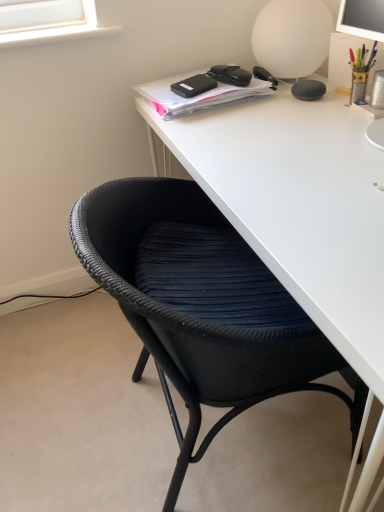
Identify the location of matte black speaker at upper right, placed as the 3th stationery when sorted from left to right. The image size is (384, 512). (308, 90).

Describe the element at coordinates (201, 306) in the screenshot. The image size is (384, 512). I see `black woven chair at lower left` at that location.

Find the location of `black matte hard drive at upper center, the 4th stationery in the right-to-left sequence`. black matte hard drive at upper center, the 4th stationery in the right-to-left sequence is located at coordinates (193, 86).

The height and width of the screenshot is (512, 384). Find the location of `white matte desk at center`. white matte desk at center is located at coordinates (298, 205).

Is the surface of metallic gold pen holder at upper right, acting as the 4th stationery starting from the left, in direct contact with black matte glasses at upper center, acting as the third stationery starting from the right?

There is a gap between metallic gold pen holder at upper right, acting as the 4th stationery starting from the left, and black matte glasses at upper center, acting as the third stationery starting from the right.

Is metallic gold pen holder at upper right, acting as the 4th stationery starting from the left, surrounding black matte glasses at upper center, arranged as the second stationery when viewed from the left?

No.

The height and width of the screenshot is (512, 384). What are the coordinates of `the 2nd stationery above the metallic gold pen holder at upper right, acting as the 4th stationery starting from the left (from the image's perspective)` in the screenshot? It's located at (230, 75).

Is black woven chair at lower left shorter than white matte table lamp at upper right?

Incorrect, the height of black woven chair at lower left does not fall short of that of white matte table lamp at upper right.

Considering the relative sizes of black woven chair at lower left and white matte table lamp at upper right in the image provided, is black woven chair at lower left thinner than white matte table lamp at upper right?

Incorrect, the width of black woven chair at lower left is not less than that of white matte table lamp at upper right.

Can white matte table lamp at upper right be found inside black woven chair at lower left?

No.

Considering the relative sizes of black matte hard drive at upper center, placed as the first stationery when sorted from left to right, and matte black speaker at upper right, which is the second stationery from right to left, in the image provided, is black matte hard drive at upper center, placed as the first stationery when sorted from left to right, taller than matte black speaker at upper right, which is the second stationery from right to left,?

No, black matte hard drive at upper center, placed as the first stationery when sorted from left to right, is not taller than matte black speaker at upper right, which is the second stationery from right to left.

Between black matte hard drive at upper center, the 4th stationery in the right-to-left sequence, and matte black speaker at upper right, placed as the 3th stationery when sorted from left to right, which one has smaller width?

matte black speaker at upper right, placed as the 3th stationery when sorted from left to right, is thinner.

Starting from the black matte hard drive at upper center, placed as the first stationery when sorted from left to right, which stationery is the 1st one in front? Please provide its 2D coordinates.

[(308, 90)]

Between black matte hard drive at upper center, placed as the first stationery when sorted from left to right, and matte black speaker at upper right, placed as the 3th stationery when sorted from left to right, which one appears on the right side from the viewer's perspective?

matte black speaker at upper right, placed as the 3th stationery when sorted from left to right.

From the picture: From the image's perspective, which one is positioned higher, white matte desk at center or metallic gold pen holder at upper right, which is the first stationery in right-to-left order?

metallic gold pen holder at upper right, which is the first stationery in right-to-left order, appears higher in the image.

Based on the photo, does white matte desk at center contain metallic gold pen holder at upper right, which is the first stationery in right-to-left order?

No.

Considering the relative positions of white matte desk at center and metallic gold pen holder at upper right, acting as the 4th stationery starting from the left, in the image provided, is white matte desk at center to the right of metallic gold pen holder at upper right, acting as the 4th stationery starting from the left, from the viewer's perspective?

No.

Where is `table to the left of metallic gold pen holder at upper right, which is the first stationery in right-to-left order`? Image resolution: width=384 pixels, height=512 pixels. table to the left of metallic gold pen holder at upper right, which is the first stationery in right-to-left order is located at coordinates (298, 205).

Is black woven chair at lower left turned away from metallic gold pen holder at upper right, which is the first stationery in right-to-left order?

No, black woven chair at lower left is not facing away from metallic gold pen holder at upper right, which is the first stationery in right-to-left order.

From the picture: From a real-world perspective, relative to metallic gold pen holder at upper right, which is the first stationery in right-to-left order, is black woven chair at lower left vertically above or below?

In terms of real-world spatial position, black woven chair at lower left is below metallic gold pen holder at upper right, which is the first stationery in right-to-left order.

Which object is wider, black woven chair at lower left or metallic gold pen holder at upper right, which is the first stationery in right-to-left order?

Wider between the two is black woven chair at lower left.

How distant is black woven chair at lower left from metallic gold pen holder at upper right, which is the first stationery in right-to-left order?

black woven chair at lower left and metallic gold pen holder at upper right, which is the first stationery in right-to-left order, are 28.77 inches apart.

Is black matte hard drive at upper center, placed as the first stationery when sorted from left to right, wider than black woven chair at lower left?

Incorrect, the width of black matte hard drive at upper center, placed as the first stationery when sorted from left to right, does not surpass that of black woven chair at lower left.

What's the angular difference between black matte hard drive at upper center, placed as the first stationery when sorted from left to right, and black woven chair at lower left's facing directions?

The angle between the facing direction of black matte hard drive at upper center, placed as the first stationery when sorted from left to right, and the facing direction of black woven chair at lower left is 162 degrees.

Which is behind, black matte hard drive at upper center, placed as the first stationery when sorted from left to right, or black woven chair at lower left?

black matte hard drive at upper center, placed as the first stationery when sorted from left to right.

From a real-world perspective, is black matte hard drive at upper center, placed as the first stationery when sorted from left to right, physically below black woven chair at lower left?

No, from a real-world perspective, black matte hard drive at upper center, placed as the first stationery when sorted from left to right, is not beneath black woven chair at lower left.

From the image's perspective, is white matte table lamp at upper right positioned above or below matte black speaker at upper right, placed as the 3th stationery when sorted from left to right?

From the image's perspective, white matte table lamp at upper right appears above matte black speaker at upper right, placed as the 3th stationery when sorted from left to right.

Is white matte table lamp at upper right beside matte black speaker at upper right, placed as the 3th stationery when sorted from left to right?

white matte table lamp at upper right and matte black speaker at upper right, placed as the 3th stationery when sorted from left to right, are clearly separated.

Is white matte table lamp at upper right looking in the opposite direction of matte black speaker at upper right, which is the second stationery from right to left?

No, white matte table lamp at upper right is not facing away from matte black speaker at upper right, which is the second stationery from right to left.

Which of these two, white matte table lamp at upper right or matte black speaker at upper right, which is the second stationery from right to left, is smaller?

Smaller between the two is matte black speaker at upper right, which is the second stationery from right to left.

Locate an element on the screen. The height and width of the screenshot is (512, 384). stationery that is the 3rd one when counting forward from the black matte glasses at upper center, acting as the third stationery starting from the right is located at coordinates (361, 71).

This screenshot has height=512, width=384. I want to click on chair on the left of the white matte table lamp at upper right, so click(201, 306).

Estimate the real-world distances between objects in this image. Which object is further from white matte desk at center, black matte glasses at upper center, acting as the third stationery starting from the right, or black matte hard drive at upper center, the 4th stationery in the right-to-left sequence?

black matte glasses at upper center, acting as the third stationery starting from the right, lies further to white matte desk at center than the other object.

When comparing their distances from black matte notebook at upper center, does black woven chair at lower left or black matte hard drive at upper center, placed as the first stationery when sorted from left to right, seem closer?

black matte hard drive at upper center, placed as the first stationery when sorted from left to right, is closer to black matte notebook at upper center.

Considering their positions, is black matte notebook at upper center positioned closer to metallic gold pen holder at upper right, acting as the 4th stationery starting from the left, than black matte hard drive at upper center, the 4th stationery in the right-to-left sequence?

black matte notebook at upper center.

Estimate the real-world distances between objects in this image. Which object is closer to metallic gold pen holder at upper right, acting as the 4th stationery starting from the left, white matte table lamp at upper right or matte black speaker at upper right, which is the second stationery from right to left?

matte black speaker at upper right, which is the second stationery from right to left, lies closer to metallic gold pen holder at upper right, acting as the 4th stationery starting from the left, than the other object.

When comparing their distances from white matte table lamp at upper right, does black woven chair at lower left or metallic gold pen holder at upper right, acting as the 4th stationery starting from the left, seem further?

Among the two, black woven chair at lower left is located further to white matte table lamp at upper right.

Estimate the real-world distances between objects in this image. Which object is further from black matte notebook at upper center, metallic gold pen holder at upper right, which is the first stationery in right-to-left order, or matte black speaker at upper right, which is the second stationery from right to left?

metallic gold pen holder at upper right, which is the first stationery in right-to-left order, is further to black matte notebook at upper center.

Considering their positions, is black matte glasses at upper center, acting as the third stationery starting from the right, positioned further to black matte hard drive at upper center, placed as the first stationery when sorted from left to right, than matte black speaker at upper right, placed as the 3th stationery when sorted from left to right?

matte black speaker at upper right, placed as the 3th stationery when sorted from left to right, is positioned further to the anchor black matte hard drive at upper center, placed as the first stationery when sorted from left to right.

When comparing their distances from black woven chair at lower left, does black matte notebook at upper center or metallic gold pen holder at upper right, acting as the 4th stationery starting from the left, seem closer?

black matte notebook at upper center is closer to black woven chair at lower left.

The image size is (384, 512). I want to click on chair between white matte desk at center and black matte glasses at upper center, acting as the third stationery starting from the right, in the front-back direction, so click(x=201, y=306).

Identify the location of notebook that lies between black matte glasses at upper center, acting as the third stationery starting from the right, and black woven chair at lower left from top to bottom. (206, 89).

Image resolution: width=384 pixels, height=512 pixels. In order to click on stationery between white matte desk at center and white matte table lamp at upper right along the z-axis in this screenshot , I will do `click(361, 71)`.

Where is `stationery that lies between metallic gold pen holder at upper right, acting as the 4th stationery starting from the left, and black woven chair at lower left from top to bottom`? The height and width of the screenshot is (512, 384). stationery that lies between metallic gold pen holder at upper right, acting as the 4th stationery starting from the left, and black woven chair at lower left from top to bottom is located at coordinates (308, 90).